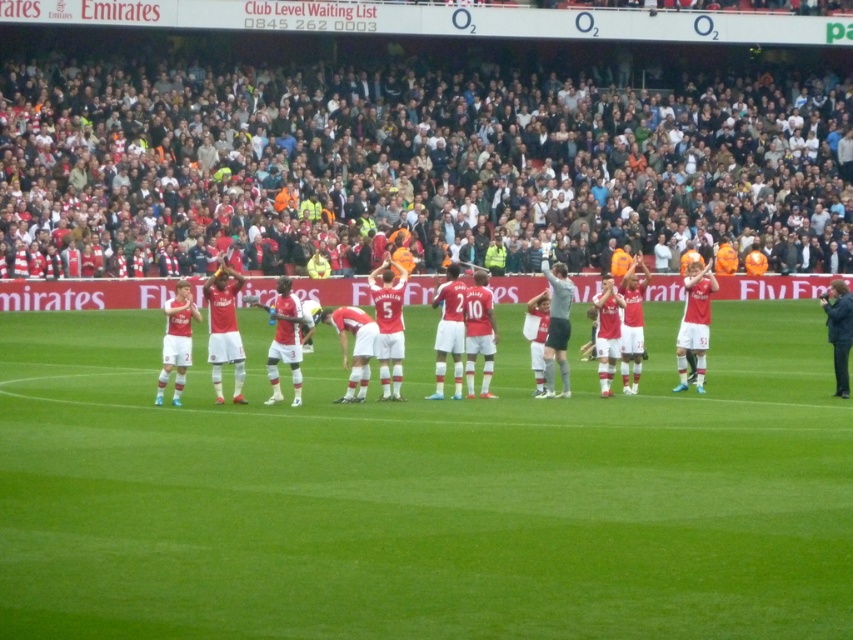
You are a photographer standing at the edge of the field. You want to take a photo that includes both the green grass football field at center and the dark gray crowd at upper center. Which object will appear larger in your photo?

The green grass football field at center will appear larger in the photo because it is closer to the viewer than the dark gray crowd at upper center.

You are a photographer at the stadium. You want to take a photo of the matte red jersey at center without the dark gray crowd at upper center appearing in the background. Is this possible based on their positions?

The dark gray crowd at upper center is much taller than the matte red jersey at center, so it will likely block the background when taking the photo. Therefore, it might not be possible to capture the matte red jersey at center without the dark gray crowd at upper center in the background.

From the picture: You are a referee standing at the center circle of the soccer field. You need to determine which of the two points, point (502, 620) or point (245, 268), is closer to the spectators in the stands. Based on their positions, which point is closer?

Point (502, 620) is in front of point (245, 268), so it is closer to the spectators in the stands.